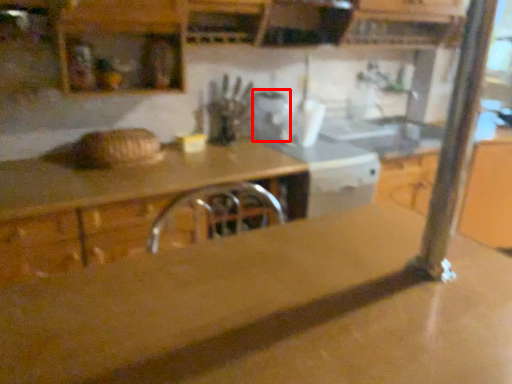
Question: From the image's perspective, considering the relative positions of appliance (annotated by the red box) and countertop in the image provided, where is appliance (annotated by the red box) located with respect to the staircase?

Choices:
 (A) below
 (B) above

Answer: (B)